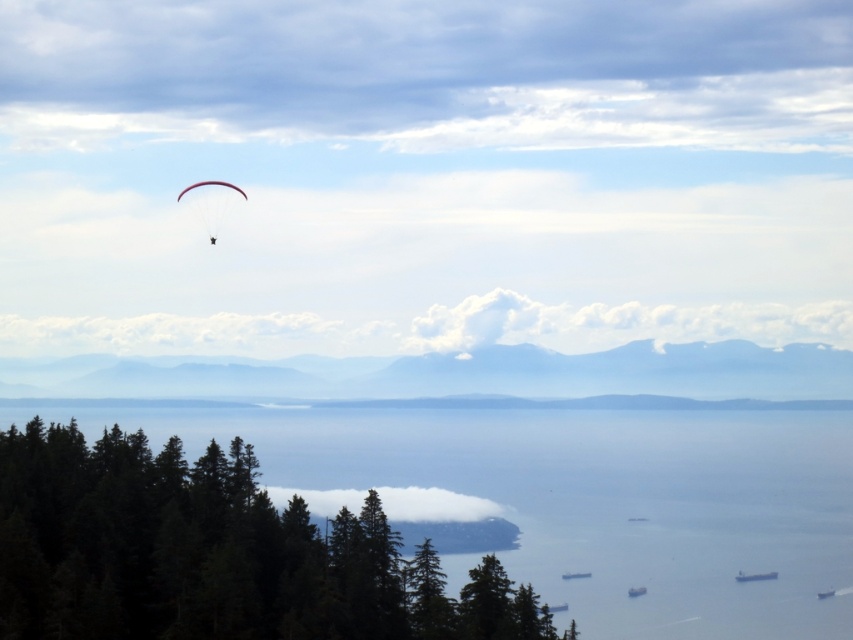
Does point (457, 636) come closer to viewer compared to point (312, 497)?

Yes, it is.

The height and width of the screenshot is (640, 853). Identify the location of green matte trees at lower left. (213, 554).

Is the position of green matte trees at lower left less distant than that of matte white parachute at upper left?

Yes, green matte trees at lower left is closer to the viewer.

This screenshot has width=853, height=640. Describe the element at coordinates (213, 554) in the screenshot. I see `green matte trees at lower left` at that location.

Where is `green matte trees at lower left`? This screenshot has height=640, width=853. green matte trees at lower left is located at coordinates (213, 554).

Does point (422, 492) come behind point (219, 218)?

No, it is not.

Does white fluffy cloud at center appear over matte white parachute at upper left?

Incorrect, white fluffy cloud at center is not positioned above matte white parachute at upper left.

Is point (473, 513) closer to viewer compared to point (207, 180)?

No, it is not.

I want to click on white fluffy cloud at center, so click(434, 504).